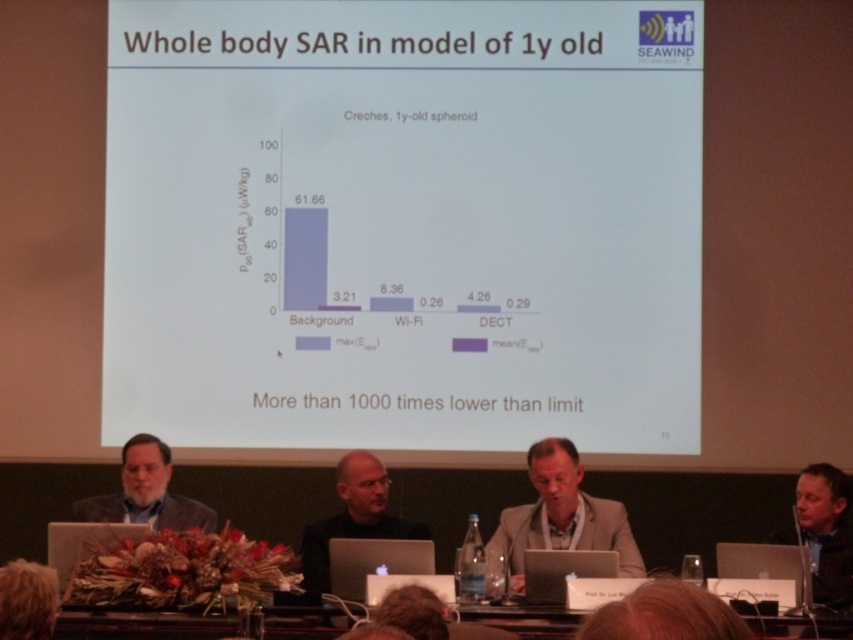
Question: Does light beige suit at center appear over matte black laptop at center?

Choices:
 (A) yes
 (B) no

Answer: (A)

Question: Is beige fabric jacket at lower left to the left of silver metallic laptop at center from the viewer's perspective?

Choices:
 (A) no
 (B) yes

Answer: (B)

Question: Is dark gray suit at lower right bigger than blonde hair at lower left?

Choices:
 (A) yes
 (B) no

Answer: (A)

Question: Which point is farther to the camera?

Choices:
 (A) black plastic laptop at lower right
 (B) white matte projector screen at upper center
 (C) matte black laptop at center
 (D) blonde hair at lower left

Answer: (B)

Question: Which object is positioned closest to the black matte jacket at center?

Choices:
 (A) white matte projector screen at upper center
 (B) silver metallic laptop at center
 (C) black plastic laptop at lower right
 (D) beige fabric jacket at lower left

Answer: (B)

Question: Which point appears closest to the camera in this image?

Choices:
 (A) 316,547
 (B) 585,561
 (C) 828,528
 (D) 149,512

Answer: (B)